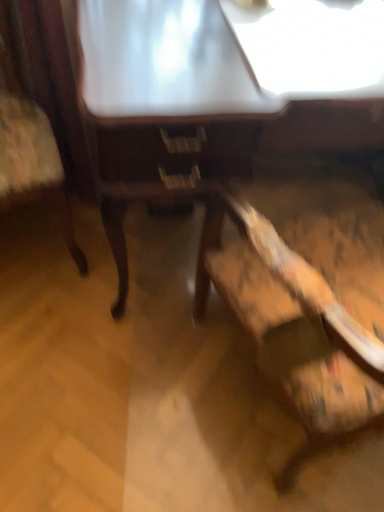
Where is `free point below wooden chair at left, the first chair positioned from the left (from a real-world perspective)`? free point below wooden chair at left, the first chair positioned from the left (from a real-world perspective) is located at coordinates (36, 237).